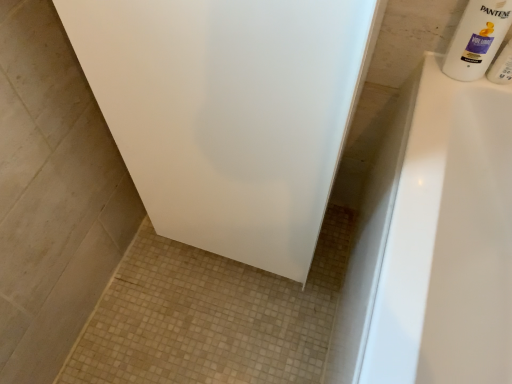
Question: In terms of width, does white glossy shampoo bottle at upper right look wider or thinner when compared to white plastic bottle at upper right?

Choices:
 (A) thin
 (B) wide

Answer: (B)

Question: In terms of height, does white glossy shampoo bottle at upper right look taller or shorter compared to white plastic bottle at upper right?

Choices:
 (A) short
 (B) tall

Answer: (B)

Question: Is white glossy shampoo bottle at upper right spatially inside white plastic bottle at upper right, or outside of it?

Choices:
 (A) outside
 (B) inside

Answer: (A)

Question: Is white plastic bottle at upper right inside or outside of white glossy shampoo bottle at upper right?

Choices:
 (A) inside
 (B) outside

Answer: (B)

Question: In the image, is white plastic bottle at upper right positioned in front of or behind white glossy shampoo bottle at upper right?

Choices:
 (A) behind
 (B) front

Answer: (A)

Question: In terms of size, does white plastic bottle at upper right appear bigger or smaller than white glossy shampoo bottle at upper right?

Choices:
 (A) big
 (B) small

Answer: (B)

Question: From the image's perspective, is white plastic bottle at upper right above or below white glossy shampoo bottle at upper right?

Choices:
 (A) above
 (B) below

Answer: (B)